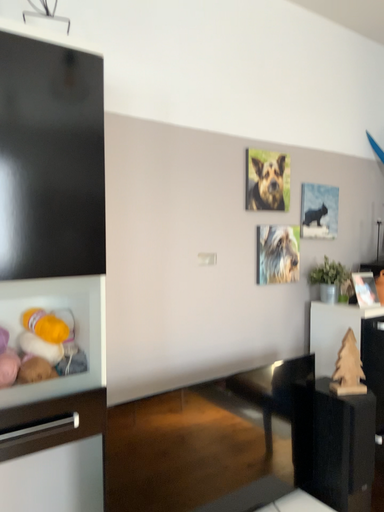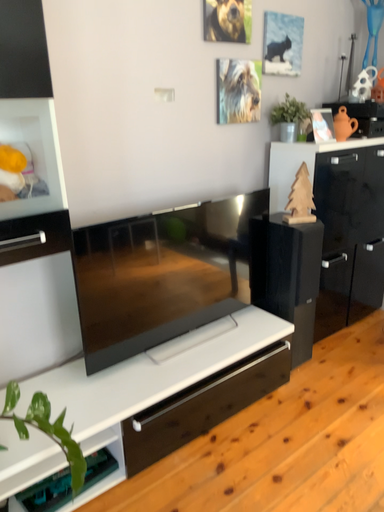
Question: Which way did the camera rotate in the video?

Choices:
 (A) rotated downward
 (B) rotated upward

Answer: (A)